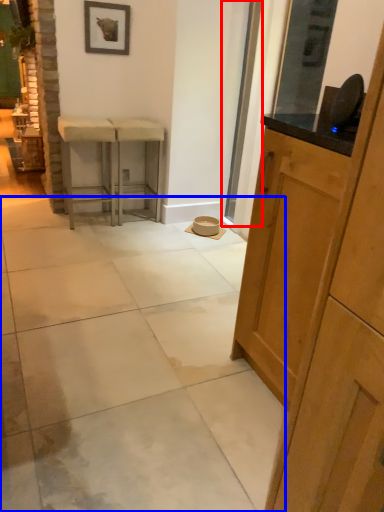
Question: Which object is further to the camera taking this photo, screen door (highlighted by a red box) or concrete (highlighted by a blue box)?

Choices:
 (A) screen door
 (B) concrete

Answer: (A)